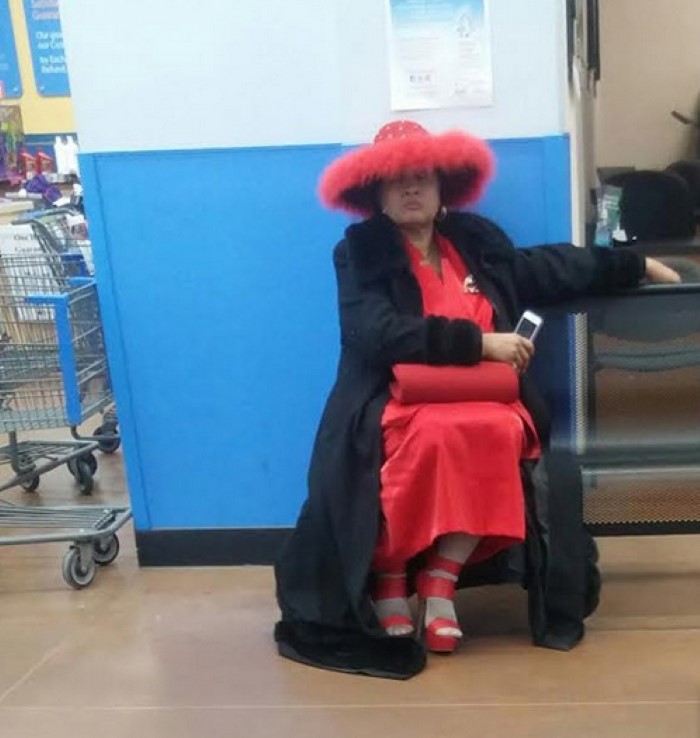
The image size is (700, 738). In order to click on coat in this screenshot , I will do `click(368, 328)`.